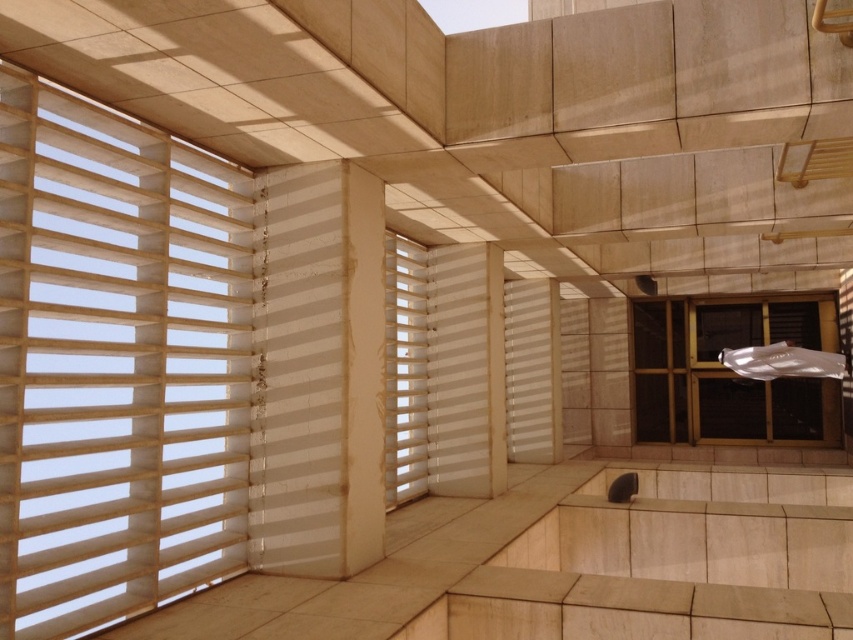
Which is below, matte black window at right or white matte window at center?

matte black window at right is lower down.

Is point (701, 336) positioned behind point (422, 332)?

That is True.

Is point (793, 316) less distant than point (397, 390)?

No, (793, 316) is behind (397, 390).

The image size is (853, 640). What are the coordinates of `matte black window at right` in the screenshot? It's located at (726, 372).

Which is behind, point (97, 365) or point (421, 486)?

Positioned behind is point (421, 486).

The image size is (853, 640). I want to click on white matte blinds at left, so click(115, 364).

Which is more to the right, white matte blinds at left or matte black window at right?

Positioned to the right is matte black window at right.

Can you confirm if white matte blinds at left is positioned above matte black window at right?

Indeed, white matte blinds at left is positioned over matte black window at right.

Locate an element on the screen. white matte blinds at left is located at coordinates (115, 364).